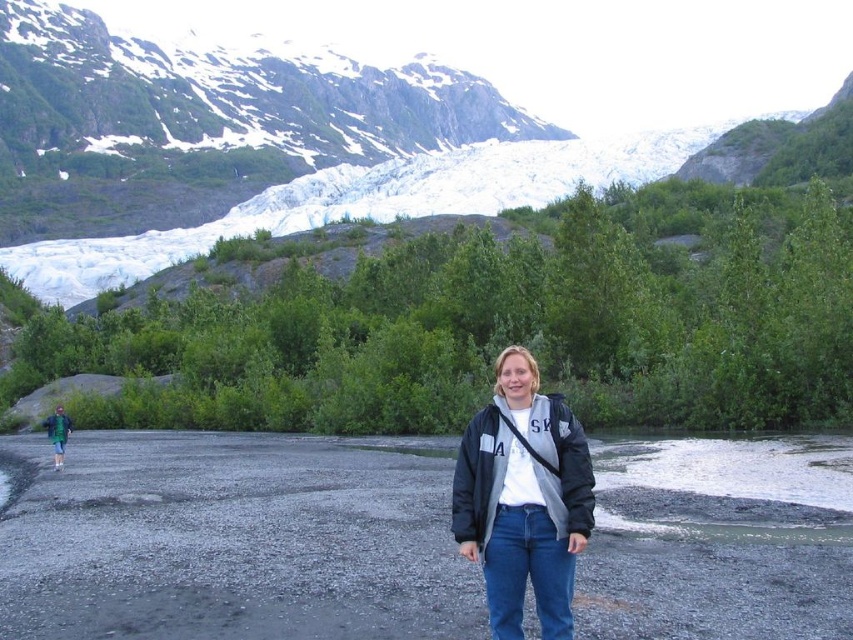
You are trying to decide which jacket to wear for a hike. You need a wider jacket to keep warm. Based on the image, which jacket between the matte gray jacket at center and the green fabric jacket at lower left should you choose?

The green fabric jacket at lower left has a greater width than the matte gray jacket at center, so you should choose the green fabric jacket at lower left for a wider option.